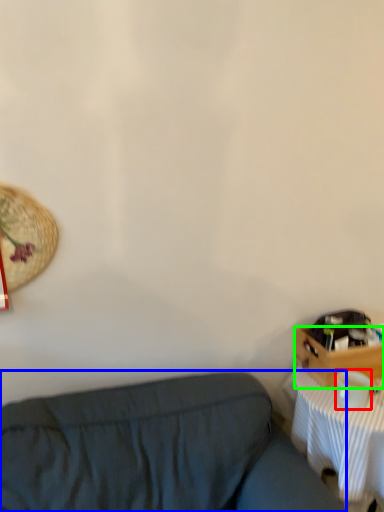
Question: Which is nearer to the coffee cup (highlighted by a red box)? studio couch (highlighted by a blue box) or drawer (highlighted by a green box).

Choices:
 (A) studio couch
 (B) drawer

Answer: (B)